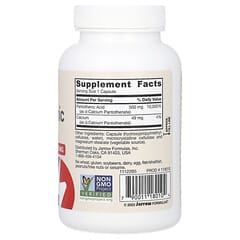
You are a GUI agent. You are given a task and a screenshot of the screen. Output one action in this format:
    pyautogui.click(x=<x>, y=<y>)
    Task: Click on the plant
    The width and height of the screenshot is (240, 240).
    Given the screenshot: What is the action you would take?
    pyautogui.click(x=87, y=188)